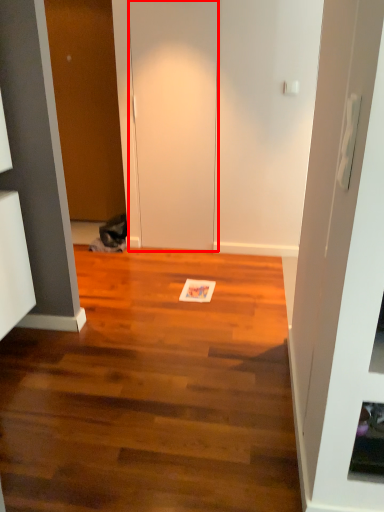
Question: From the image's perspective, where is door (annotated by the red box) located relative to door?

Choices:
 (A) above
 (B) below

Answer: (B)